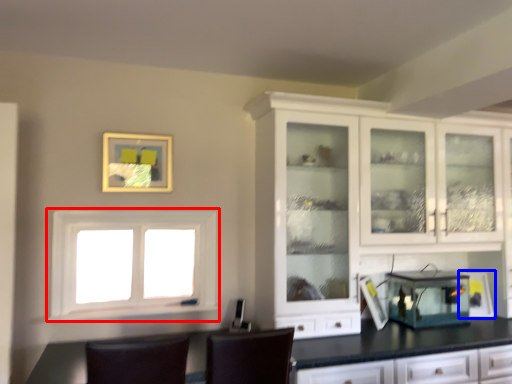
Question: Which point is closer to the camera, window (highlighted by a red box) or appliance (highlighted by a blue box)?

Choices:
 (A) window
 (B) appliance

Answer: (A)